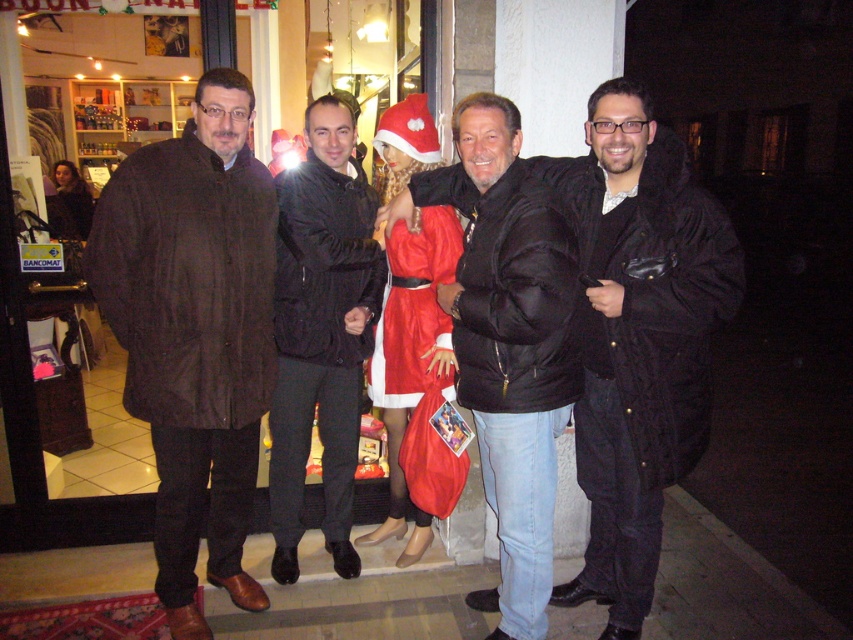
You are standing at point (535, 348) and want to walk to point (209, 400). Is the point you want to reach in front of or behind you?

The point (209, 400) is behind point (535, 348), so the point you want to reach is behind you.

You are standing in front of the shop with the group. You need to determine which of the two points, point (241, 328) or point (610, 211), is closer to you. Which one is closer?

Point (241, 328) is closer to you because it is further to the viewer than point (610, 211).

You are a photographer trying to capture the group photo of the four individuals outside the shop. You want to ensure that the brown textured coat at left is included in the frame. Based on its position coordinates, can you confirm if the coat is within the camera frame boundaries?

The brown textured coat at left is positioned at coordinates point (x=194, y=332), which is within the camera frame boundaries, so it will be included in the photo.